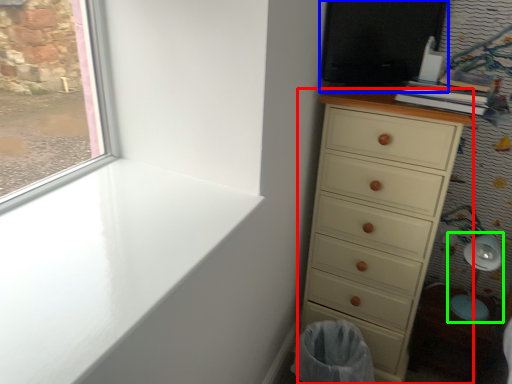
Question: Which is farther away from chest of drawers (highlighted by a red box)? screen door (highlighted by a blue box) or swivel chair (highlighted by a green box)?

Choices:
 (A) screen door
 (B) swivel chair

Answer: (B)